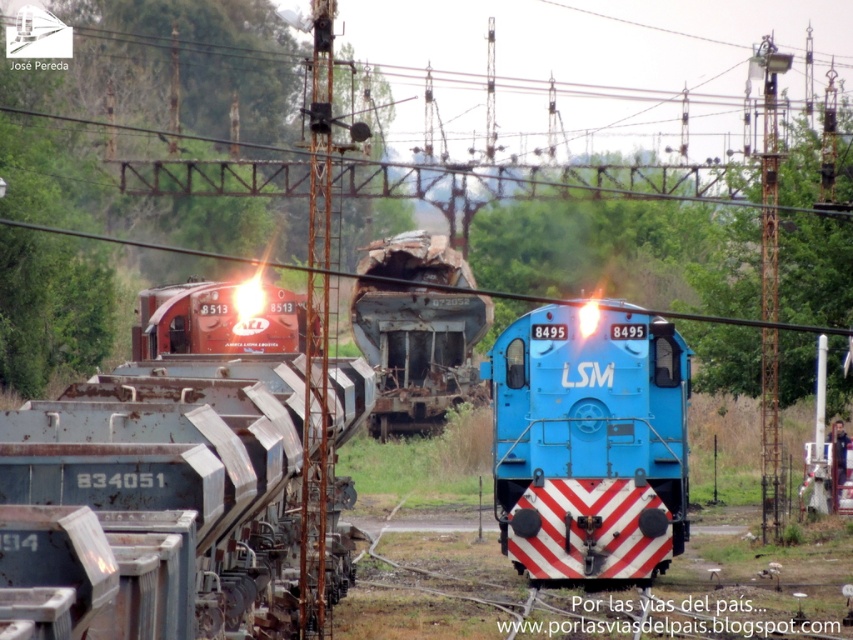
Question: Which of the following is the farthest from the observer?

Choices:
 (A) (248, 323)
 (B) (518, 332)
 (C) (374, 426)

Answer: (C)

Question: Which object is the farthest from the rusty metal train car at center?

Choices:
 (A) blue glossy locomotive at center
 (B) matte red locomotive at center

Answer: (A)

Question: Observing the image, what is the correct spatial positioning of blue glossy locomotive at center in reference to matte red locomotive at center?

Choices:
 (A) above
 (B) below

Answer: (B)

Question: Considering the real-world distances, which object is farthest from the rusty metal train car at center?

Choices:
 (A) blue glossy locomotive at center
 (B) matte red locomotive at center

Answer: (A)

Question: Can you confirm if blue glossy locomotive at center is bigger than matte red locomotive at center?

Choices:
 (A) no
 (B) yes

Answer: (A)

Question: Is rusty metal train car at center closer to the viewer compared to matte red locomotive at center?

Choices:
 (A) yes
 (B) no

Answer: (B)